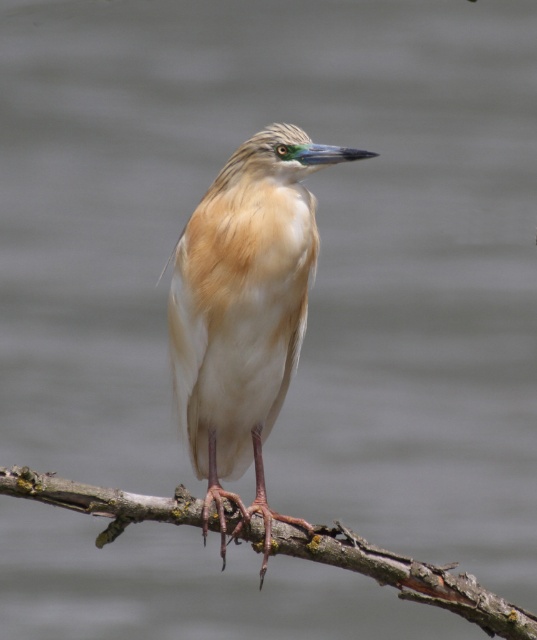
You are a birdwatcher observing the scene. You notice the light brown feathered bird at center and the brown rough branch at center. Which object is closer to you?

The light brown feathered bird at center is closer to you than the brown rough branch at center.